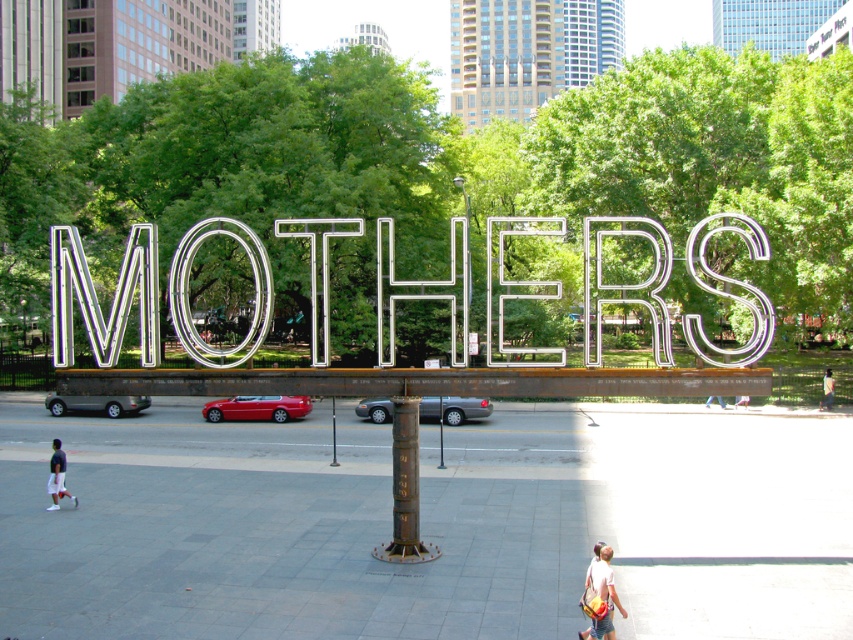
Question: Is gray concrete pavement at center below light brown leather jacket at lower right?

Choices:
 (A) yes
 (B) no

Answer: (A)

Question: Is light pink fabric shirt at lower right below light brown leather jacket at lower right?

Choices:
 (A) no
 (B) yes

Answer: (B)

Question: Which object is closer to the camera taking this photo?

Choices:
 (A) dark gray shorts at lower left
 (B) light brown leather jacket at lower right

Answer: (A)

Question: Considering the real-world distances, which object is closest to the light brown leather jacket at lower right?

Choices:
 (A) light pink fabric shirt at lower right
 (B) dark gray shorts at lower left
 (C) gray concrete pavement at center

Answer: (C)

Question: Is light pink fabric shirt at lower right bigger than light brown leather jacket at lower right?

Choices:
 (A) yes
 (B) no

Answer: (A)

Question: Considering the real-world distances, which object is farthest from the light brown leather jacket at lower right?

Choices:
 (A) gray concrete pavement at center
 (B) light pink fabric shirt at lower right

Answer: (B)